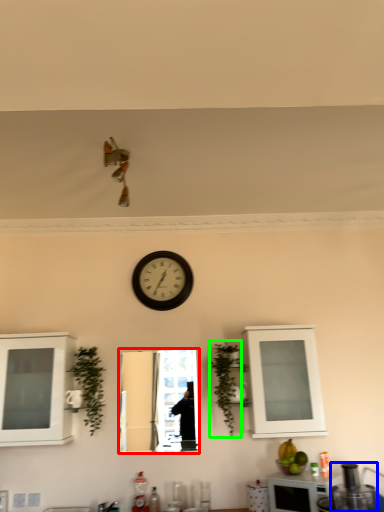
Question: Considering the real-world distances, which object is closest to mirror (highlighted by a red box)? appliance (highlighted by a blue box) or plant (highlighted by a green box).

Choices:
 (A) appliance
 (B) plant

Answer: (B)